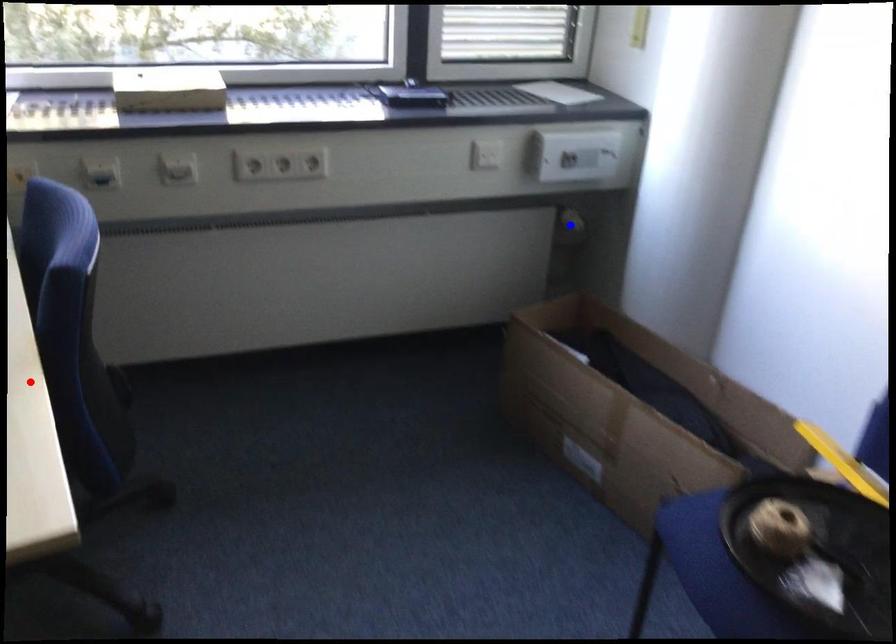
Question: Two points are marked on the image. Which point is closer to the camera?

Choices:
 (A) Blue point is closer.
 (B) Red point is closer.

Answer: (B)